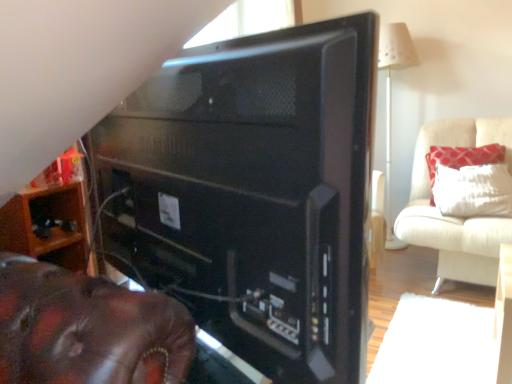
Question: Is wooden shelf at lower left, which ranks as the first furniture in front-to-back order, inside the boundaries of white textured pillow at upper right, or outside?

Choices:
 (A) inside
 (B) outside

Answer: (B)

Question: Is point (34, 195) positioned closer to the camera than point (433, 148)?

Choices:
 (A) farther
 (B) closer

Answer: (B)

Question: Which of these objects is positioned closest to the black matte desktop computer at center?

Choices:
 (A) white fabric cushion at upper right, placed as the 2th furniture when sorted from front to back
 (B) white textured pillow at upper right
 (C) wooden shelf at lower left, positioned as the second furniture in back-to-front order

Answer: (C)

Question: Which is farther from the white fabric cushion at upper right, which is the first furniture in back-to-front order?

Choices:
 (A) black matte desktop computer at center
 (B) wooden shelf at lower left, which ranks as the second furniture in right-to-left order
 (C) white textured pillow at upper right

Answer: (B)